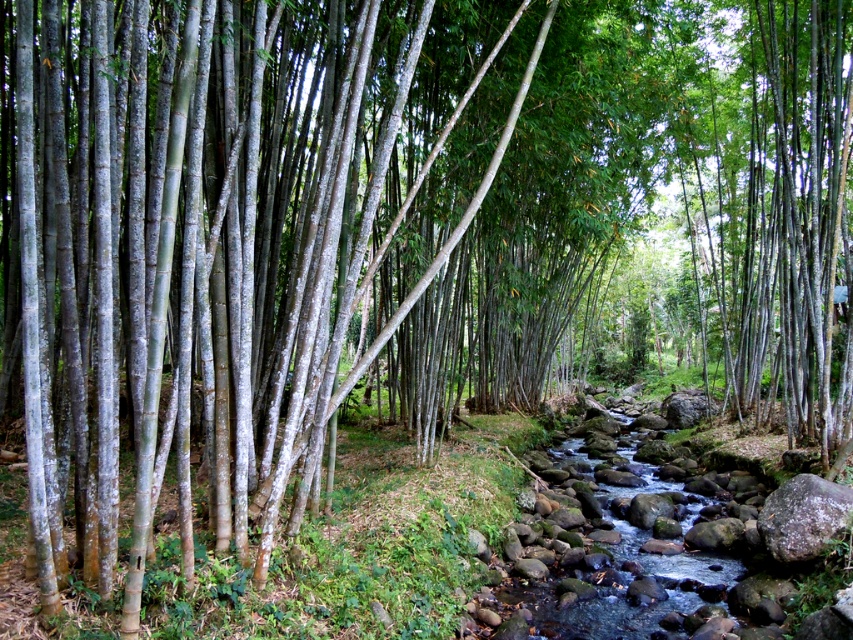
Question: Is smooth gray rocks at center positioned at the back of gray rough rock at lower right?

Choices:
 (A) no
 (B) yes

Answer: (A)

Question: Can you confirm if smooth gray rocks at center is smaller than gray rough rock at lower right?

Choices:
 (A) yes
 (B) no

Answer: (B)

Question: Which object appears closest to the camera in this image?

Choices:
 (A) gray rough rock at lower right
 (B) smooth gray rocks at center

Answer: (B)

Question: Is smooth gray rocks at center thinner than gray rough rock at lower right?

Choices:
 (A) no
 (B) yes

Answer: (A)

Question: Which of the following is the farthest from the observer?

Choices:
 (A) gray rough rock at lower right
 (B) smooth gray rocks at center

Answer: (A)